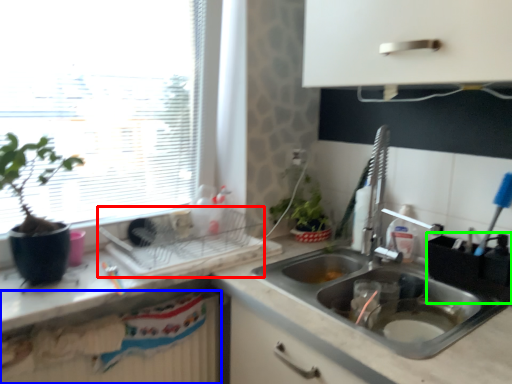
Question: Which object is the closest to the appliance (highlighted by a red box)? Choose among these: radiator (highlighted by a blue box) or appliance (highlighted by a green box).

Choices:
 (A) radiator
 (B) appliance

Answer: (A)